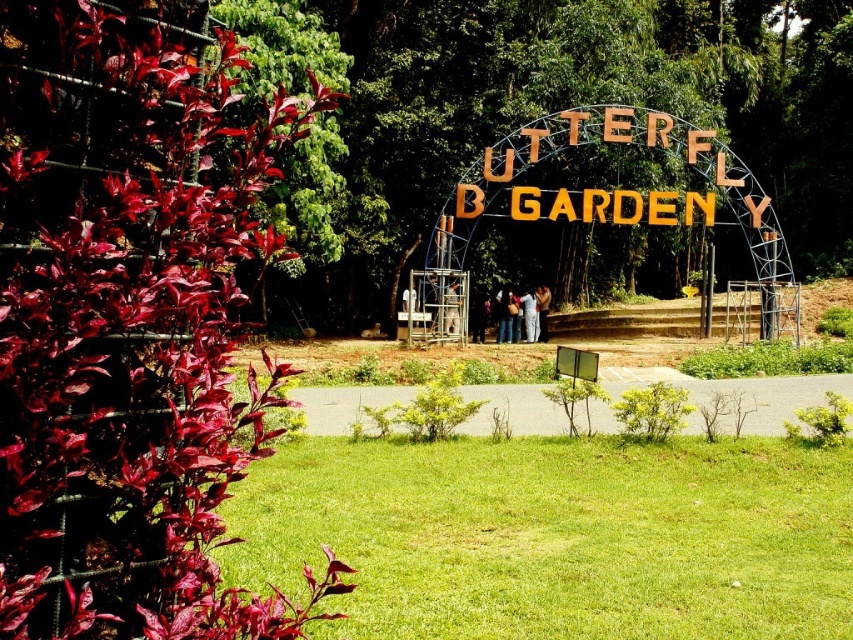
Question: Which object is farther from the camera taking this photo?

Choices:
 (A) light brown wooden sign at center
 (B) metallic silver person at center
 (C) white fabric at center
 (D) purple fabric at center

Answer: (A)

Question: Which is farther from the metallic silver person at center?

Choices:
 (A) purple fabric at center
 (B) matte blue shirt at center
 (C) metallic scaffolding at center

Answer: (B)

Question: Does metallic scaffolding at center lie in front of metallic silver person at center?

Choices:
 (A) no
 (B) yes

Answer: (B)

Question: Where is purple fabric at center located in relation to light brown wooden sign at center in the image?

Choices:
 (A) right
 (B) left

Answer: (B)

Question: Which of these objects is positioned closest to the metallic scaffolding at center?

Choices:
 (A) purple fabric at center
 (B) metallic silver person at center
 (C) light brown wooden sign at center
 (D) matte blue shirt at center

Answer: (B)

Question: Is metallic scaffolding at center above purple fabric at center?

Choices:
 (A) no
 (B) yes

Answer: (B)